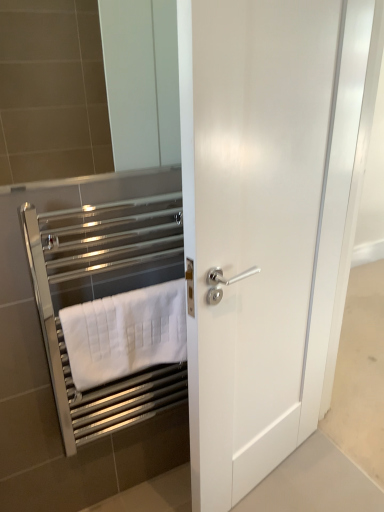
What are the coordinates of `chrome metallic towel rack at left` in the screenshot? It's located at (102, 297).

The height and width of the screenshot is (512, 384). Find the location of `white glossy door at center`. white glossy door at center is located at coordinates (251, 226).

How different are the orientations of white matte towel at left and white glossy door at center in degrees?

The angular difference between white matte towel at left and white glossy door at center is 13.1 degrees.

Choose the correct answer: Is white matte towel at left inside white glossy door at center or outside it?

white matte towel at left is not enclosed by white glossy door at center.

Looking at this image, from the image's perspective, between white matte towel at left and white glossy door at center, which one is located above?

white glossy door at center, from the image's perspective.

From a real-world perspective, is white matte towel at left positioned above or below white glossy door at center?

white matte towel at left is situated lower than white glossy door at center in the real world.

Consider the image. Is chrome metallic towel rack at left taller or shorter than white glossy door at center?

Clearly, chrome metallic towel rack at left is shorter compared to white glossy door at center.

From a real-world perspective, between chrome metallic towel rack at left and white glossy door at center, who is vertically lower?

chrome metallic towel rack at left.

Who is smaller, chrome metallic towel rack at left or white glossy door at center?

chrome metallic towel rack at left.

Is chrome metallic towel rack at left with white glossy door at center?

No, chrome metallic towel rack at left is not touching white glossy door at center.

Identify the location of closet that is above the white matte towel at left (from a real-world perspective). Image resolution: width=384 pixels, height=512 pixels. (102, 297).

Which is in front, point (170, 304) or point (158, 400)?

Positioned in front is point (170, 304).

Measure the distance between white matte towel at left and chrome metallic towel rack at left.

white matte towel at left and chrome metallic towel rack at left are 4.64 inches apart from each other.

Choose the correct answer: Is white matte towel at left inside chrome metallic towel rack at left or outside it?

The correct answer is: inside.

Can you tell me how much white glossy door at center and chrome metallic towel rack at left differ in facing direction?

The facing directions of white glossy door at center and chrome metallic towel rack at left are 13.1 degrees apart.

From a real-world perspective, is white glossy door at center over chrome metallic towel rack at left?

Indeed, from a real-world perspective, white glossy door at center stands above chrome metallic towel rack at left.

Looking at this image, can you confirm if white glossy door at center is positioned to the left of chrome metallic towel rack at left?

No, white glossy door at center is not to the left of chrome metallic towel rack at left.

Does white glossy door at center contain chrome metallic towel rack at left?

Definitely not — chrome metallic towel rack at left is not inside white glossy door at center.

Looking at this image, which is farther from the camera, (x=210, y=283) or (x=103, y=349)?

The point (x=103, y=349) is behind.

Is white glossy door at center positioned with its back to white matte towel at left?

white glossy door at center does not have its back to white matte towel at left.

Is white glossy door at center inside the boundaries of white matte towel at left, or outside?

white glossy door at center exists outside the volume of white matte towel at left.

How distant is white glossy door at center from white matte towel at left?

12.11 inches.

From the picture: Which of these two, chrome metallic towel rack at left or white matte towel at left, is smaller?

white matte towel at left.

Between point (53, 386) and point (75, 380), which one is positioned in front?

The point (75, 380) is closer.

Which is more to the left, chrome metallic towel rack at left or white matte towel at left?

chrome metallic towel rack at left is more to the left.

Is chrome metallic towel rack at left aimed at white matte towel at left?

Yes, chrome metallic towel rack at left is facing white matte towel at left.

This screenshot has height=512, width=384. Identify the location of door above the white matte towel at left (from a real-world perspective). (251, 226).

Where is `closet lying behind the white glossy door at center`? This screenshot has width=384, height=512. closet lying behind the white glossy door at center is located at coordinates (102, 297).

When comparing their distances from white glossy door at center, does white matte towel at left or chrome metallic towel rack at left seem closer?

white matte towel at left.

Estimate the real-world distances between objects in this image. Which object is further from chrome metallic towel rack at left, white matte towel at left or white glossy door at center?

white glossy door at center is positioned further to the anchor chrome metallic towel rack at left.

From the image, which object appears to be nearer to white matte towel at left, white glossy door at center or chrome metallic towel rack at left?

chrome metallic towel rack at left lies closer to white matte towel at left than the other object.

When comparing their distances from white glossy door at center, does chrome metallic towel rack at left or white matte towel at left seem further?

Among the two, chrome metallic towel rack at left is located further to white glossy door at center.

Based on their spatial positions, is chrome metallic towel rack at left or white glossy door at center further from white matte towel at left?

white glossy door at center is positioned further to the anchor white matte towel at left.

Estimate the real-world distances between objects in this image. Which object is closer to chrome metallic towel rack at left, white glossy door at center or white matte towel at left?

The object closer to chrome metallic towel rack at left is white matte towel at left.

This screenshot has width=384, height=512. I want to click on towel situated between chrome metallic towel rack at left and white glossy door at center from left to right, so click(x=125, y=333).